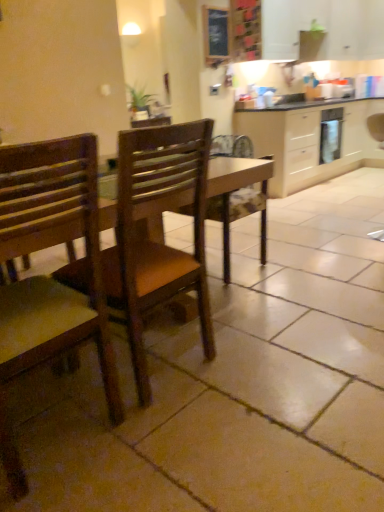
Find the location of `vacant area to the right of wooden chair at left, the second chair in the right-to-left sequence`. vacant area to the right of wooden chair at left, the second chair in the right-to-left sequence is located at coordinates (168, 443).